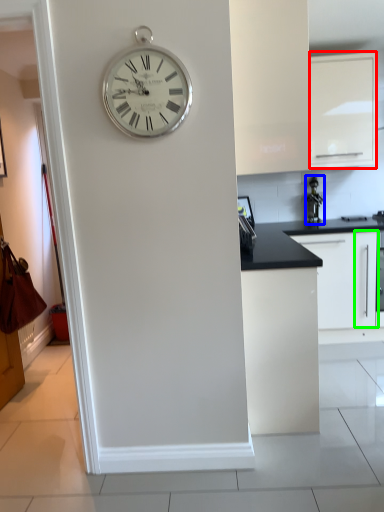
Question: Which is farther away from cabinetry (highlighted by a red box)? appliance (highlighted by a blue box) or cabinetry (highlighted by a green box)?

Choices:
 (A) appliance
 (B) cabinetry

Answer: (B)